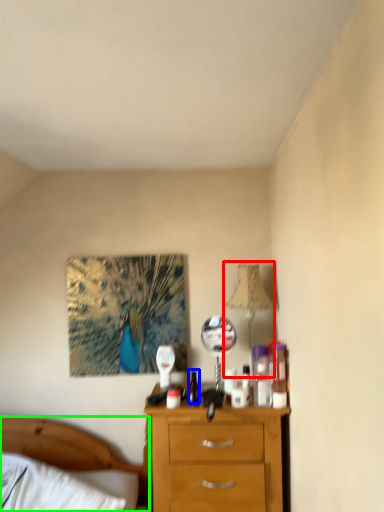
Question: Considering the real-world distances, which object is farthest from table lamp (highlighted by a red box)? bottle (highlighted by a blue box) or bed (highlighted by a green box)?

Choices:
 (A) bottle
 (B) bed

Answer: (B)